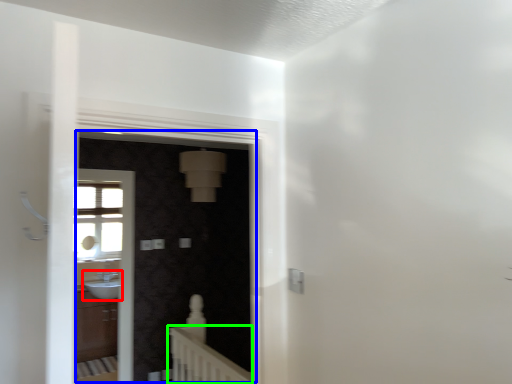
Question: Which object is positioned farthest from sink (highlighted by a red box)? Select from screen door (highlighted by a blue box) and balustrade (highlighted by a green box).

Choices:
 (A) screen door
 (B) balustrade

Answer: (B)